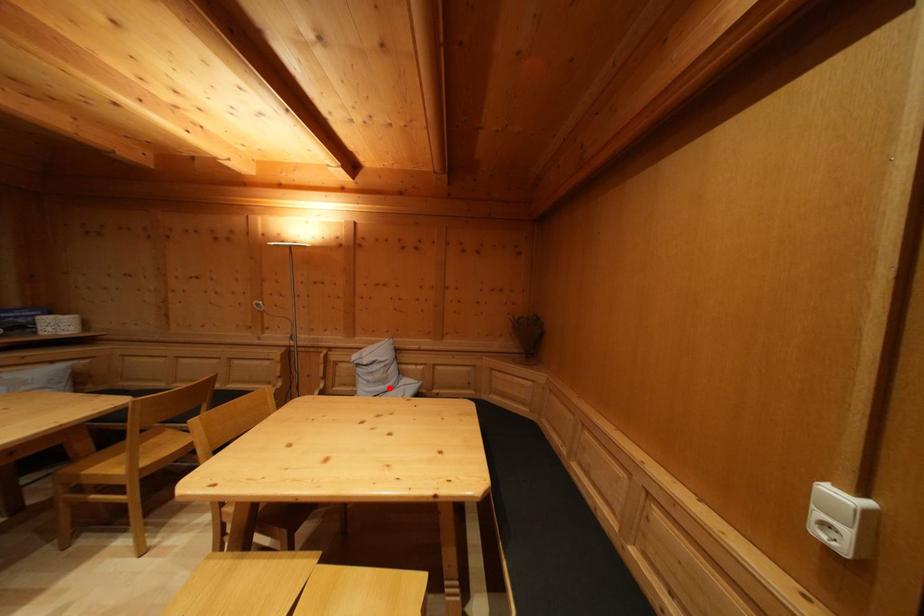
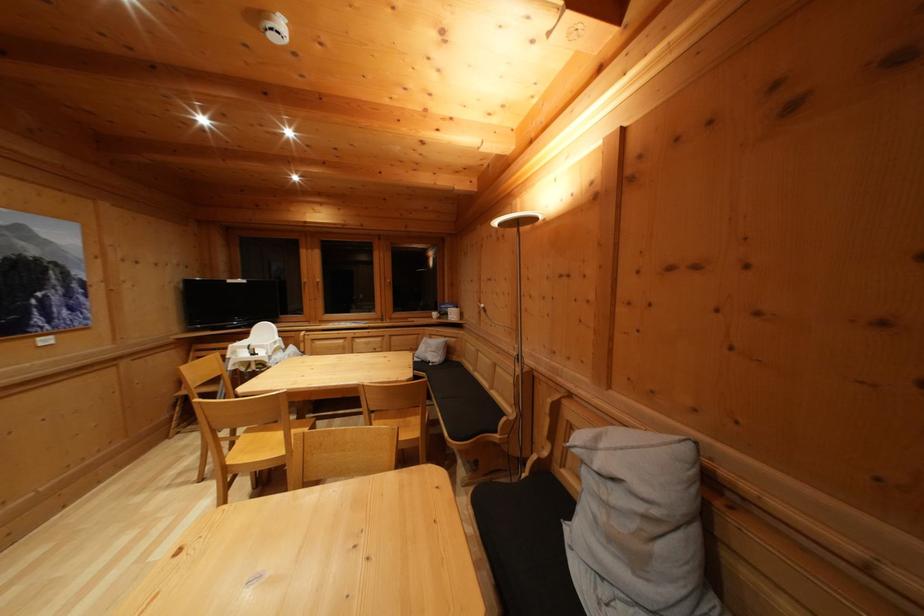
Question: A red point is marked in image1. In image2, is the corresponding 3D point closer to the camera or farther? Reply with the corresponding letter.

Choices:
 (A) The corresponding 3D point is closer.
 (B) The corresponding 3D point is farther.

Answer: (A)